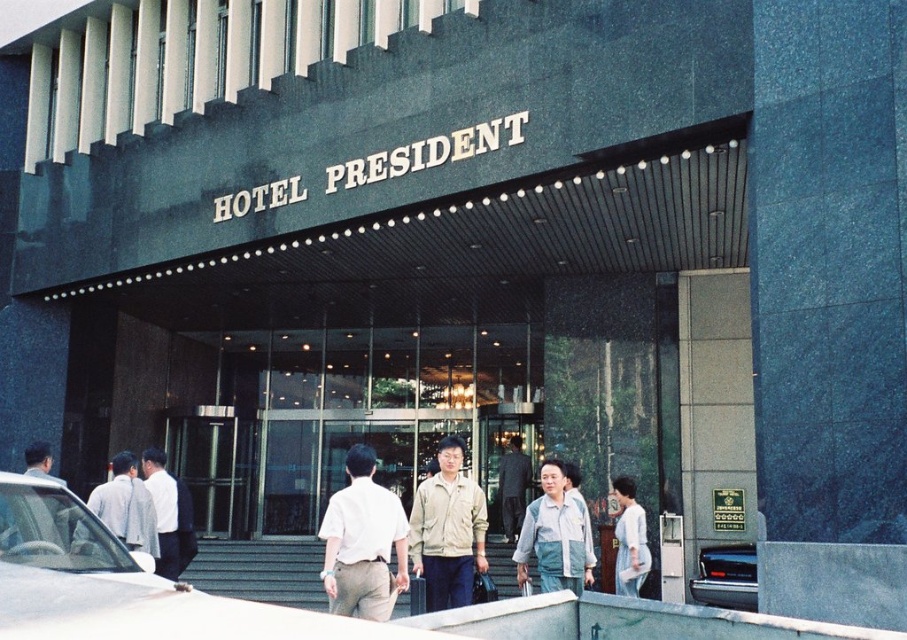
Question: Does shiny black car at lower right have a larger size compared to light beige shirt at center?

Choices:
 (A) yes
 (B) no

Answer: (A)

Question: Is silver metallic car at center closer to the viewer compared to white shirt at center?

Choices:
 (A) no
 (B) yes

Answer: (B)

Question: Which point is closer to the camera taking this photo?

Choices:
 (A) (515, 532)
 (B) (746, 547)

Answer: (B)

Question: Among these objects, which one is nearest to the camera?

Choices:
 (A) white shirt at center
 (B) light blue fabric jacket at center
 (C) khaki fabric jacket at center

Answer: (B)

Question: Which object is the closest to the dark gray suit at center?

Choices:
 (A) light gray cotton shirt at left
 (B) light beige shirt at center
 (C) shiny black car at lower right
 (D) white shirt at center

Answer: (C)

Question: In this image, where is silver metallic car at center located relative to white cotton shirt at center?

Choices:
 (A) right
 (B) left

Answer: (B)